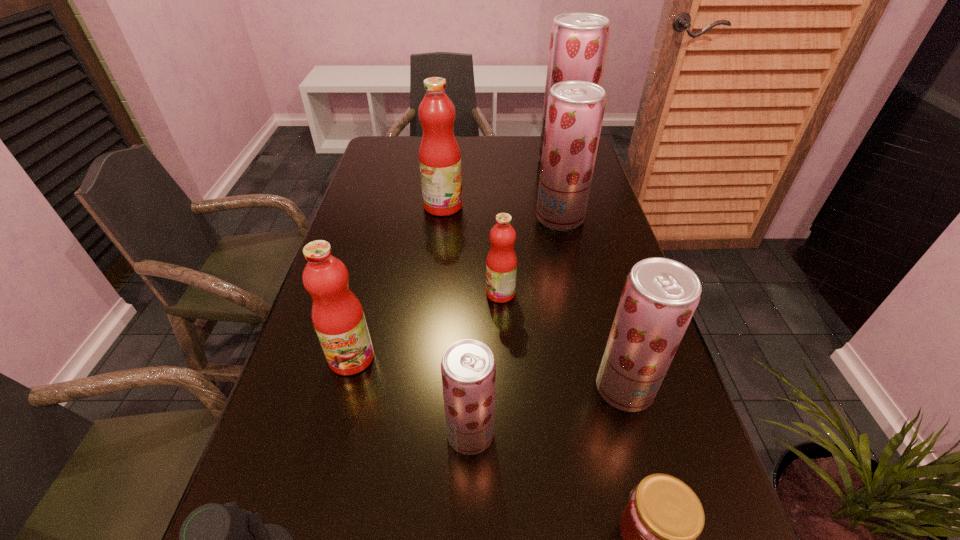
Find the location of a particular element. object present at the far edge is located at coordinates (578, 42).

Identify the location of object that is at the left edge. This screenshot has width=960, height=540. (338, 318).

This screenshot has height=540, width=960. Find the location of `object at the far right corner`. object at the far right corner is located at coordinates (578, 42).

In the image, there is a desktop. Identify the location of free space at the far edge. This screenshot has width=960, height=540. (523, 157).

Locate an element on the screen. The height and width of the screenshot is (540, 960). vacant position at the left edge of the desktop is located at coordinates (264, 468).

In the image, there is a desktop. Identify the location of free space at the right edge. The width and height of the screenshot is (960, 540). (593, 210).

This screenshot has width=960, height=540. What are the coordinates of `free space between the third smallest strawberry fruit juice and the leftmost strawberry fruit juice` in the screenshot? It's located at click(x=515, y=326).

Locate an element on the screen. This screenshot has height=540, width=960. unoccupied position between the smallest pink fruit juice and the third biggest strawberry fruit juice is located at coordinates (563, 341).

The image size is (960, 540). Identify the location of empty location between the biggest pink fruit juice and the second smallest strawberry fruit juice. (534, 297).

Identify the location of vacant space that is in between the fourth nearest fruit juice and the third biggest strawberry fruit juice. The image size is (960, 540). (563, 341).